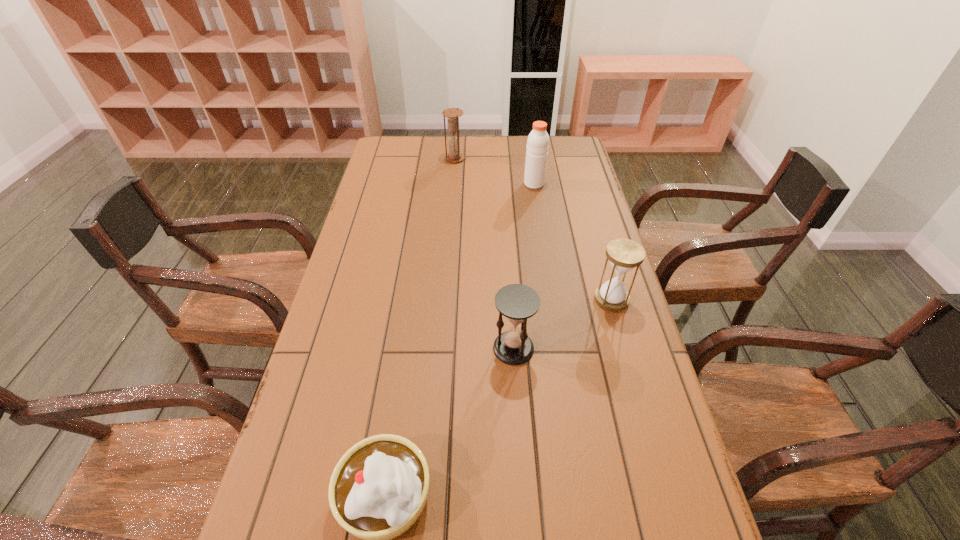
Locate an element on the screen. This screenshot has height=540, width=960. the fourth nearest object is located at coordinates (537, 147).

The width and height of the screenshot is (960, 540). In order to click on shaker in this screenshot , I will do `click(537, 147)`.

The image size is (960, 540). What are the coordinates of `the leftmost hourglass` in the screenshot? It's located at (454, 156).

I want to click on the farthest object, so pos(454,156).

Locate an element on the screen. the nearest hourglass is located at coordinates (517, 302).

The height and width of the screenshot is (540, 960). What are the coordinates of `the second nearest object` in the screenshot? It's located at (517, 302).

Where is `the second nearest hourglass`? the second nearest hourglass is located at coordinates (624, 254).

Where is `the rightmost object`? the rightmost object is located at coordinates (624, 254).

Locate an element on the screen. This screenshot has width=960, height=540. free space located on the front of the fourth nearest object is located at coordinates (540, 222).

Where is `free space located on the front of the farthest object`? free space located on the front of the farthest object is located at coordinates (451, 204).